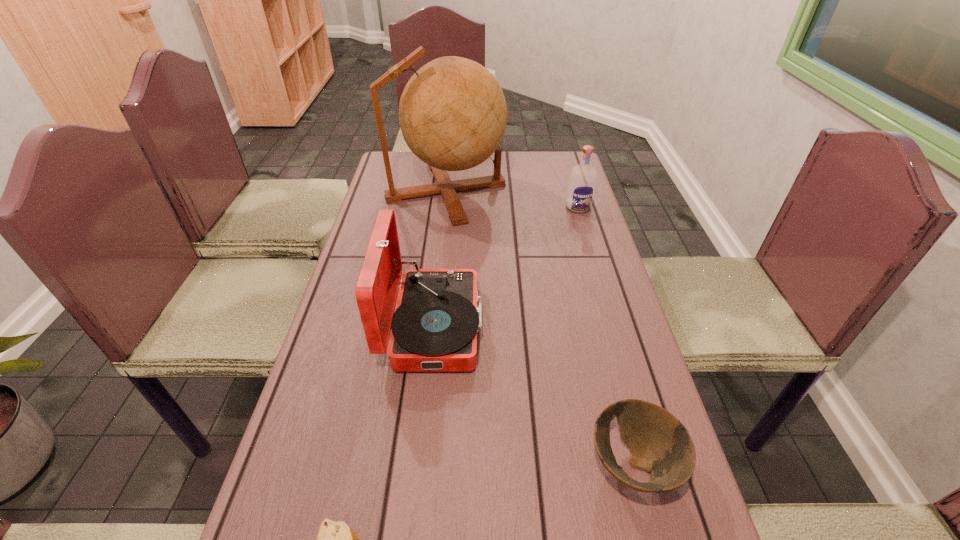
Locate an element on the screen. free space between the vodka and the tallest object is located at coordinates (513, 199).

You are a GUI agent. You are given a task and a screenshot of the screen. Output one action in this format:
    pyautogui.click(x=<x>, y=<y>)
    Task: Click on the vacant point located between the fourth shortest object and the fourth tallest object
    The width and height of the screenshot is (960, 540).
    Given the screenshot: What is the action you would take?
    pyautogui.click(x=533, y=395)

Where is `vacant area that lies between the globe and the phonograph_record`? vacant area that lies between the globe and the phonograph_record is located at coordinates (440, 259).

Locate an element on the screen. The image size is (960, 540). vacant space that's between the third tallest object and the tallest object is located at coordinates (513, 199).

Where is `free point between the tallest object and the third tallest object`? The image size is (960, 540). free point between the tallest object and the third tallest object is located at coordinates (513, 199).

I want to click on empty space that is in between the tallest object and the third nearest object, so click(x=440, y=259).

The image size is (960, 540). What are the coordinates of `object that is the third closest one to the globe` in the screenshot? It's located at (660, 444).

Identify which object is located as the second nearest to the phonograph_record. Please provide its 2D coordinates. Your answer should be formatted as a tuple, i.e. [(x, y)], where the tuple contains the x and y coordinates of a point satisfying the conditions above.

[(453, 114)]

I want to click on free space that satisfies the following two spatial constraints: 1. on the surface of the tallest object; 2. on the back side of the bowl, so click(417, 465).

Identify the location of free spot that satisfies the following two spatial constraints: 1. on the label of the third tallest object; 2. on the front-facing side of the phonograph_record. (613, 326).